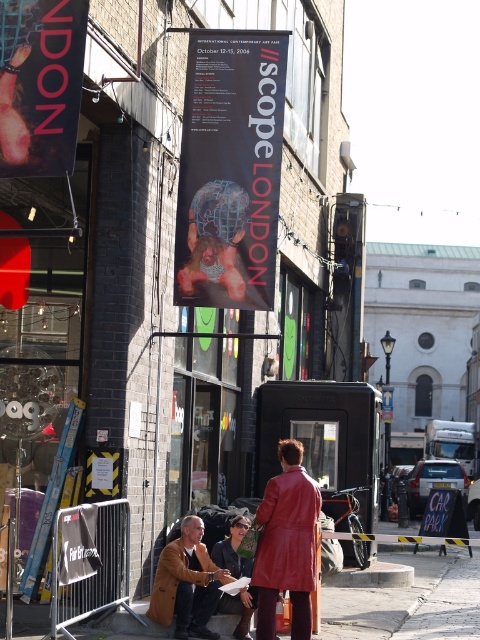
Question: Is black matte poster at center below matte pink banner at upper left?

Choices:
 (A) no
 (B) yes

Answer: (B)

Question: Does leather coat at center have a larger size compared to red leather trench coat at lower center?

Choices:
 (A) yes
 (B) no

Answer: (A)

Question: Is matte pink banner at upper left to the left of leather jacket at center from the viewer's perspective?

Choices:
 (A) yes
 (B) no

Answer: (A)

Question: Which is nearer to the leather jacket at center?

Choices:
 (A) leather coat at center
 (B) red leather trench coat at lower center

Answer: (B)

Question: Among these objects, which one is nearest to the camera?

Choices:
 (A) leather jacket at center
 (B) red leather trench coat at lower center
 (C) matte pink banner at upper left

Answer: (C)

Question: Which point is closer to the camera taking this photo?

Choices:
 (A) 238,573
 (B) 177,284

Answer: (A)